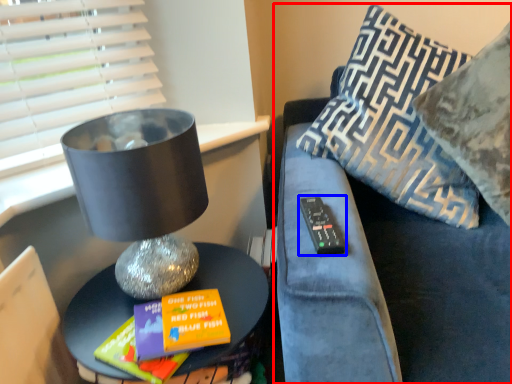
Question: Which object appears farthest to the camera in this image, furniture (highlighted by a red box) or remote (highlighted by a blue box)?

Choices:
 (A) furniture
 (B) remote

Answer: (B)